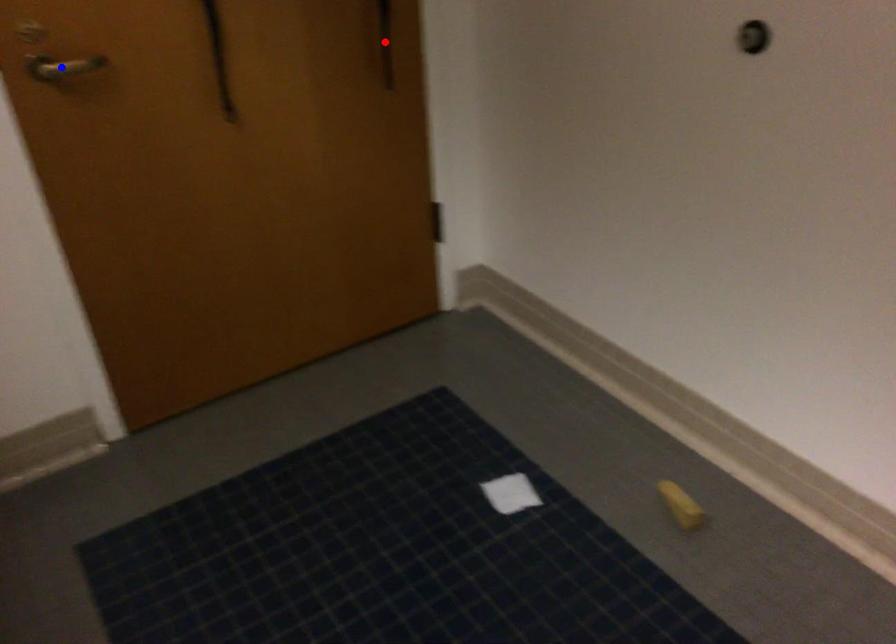
Question: Two points are marked on the image. Which point is closer to the camera?

Choices:
 (A) Blue point is closer.
 (B) Red point is closer.

Answer: (A)